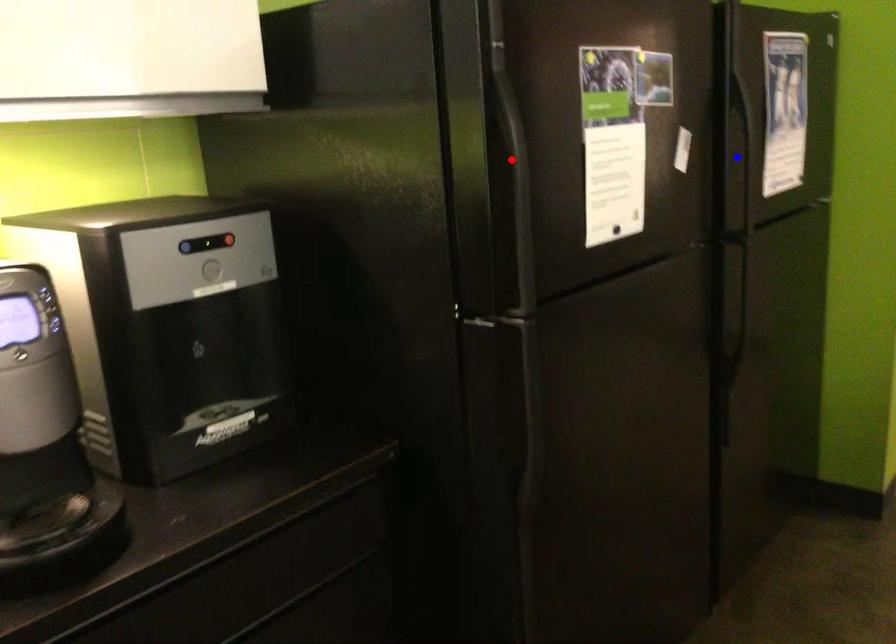
Question: In the image, two points are highlighted. Which point is nearer to the camera? Reply with the corresponding letter.

Choices:
 (A) blue point
 (B) red point

Answer: (B)